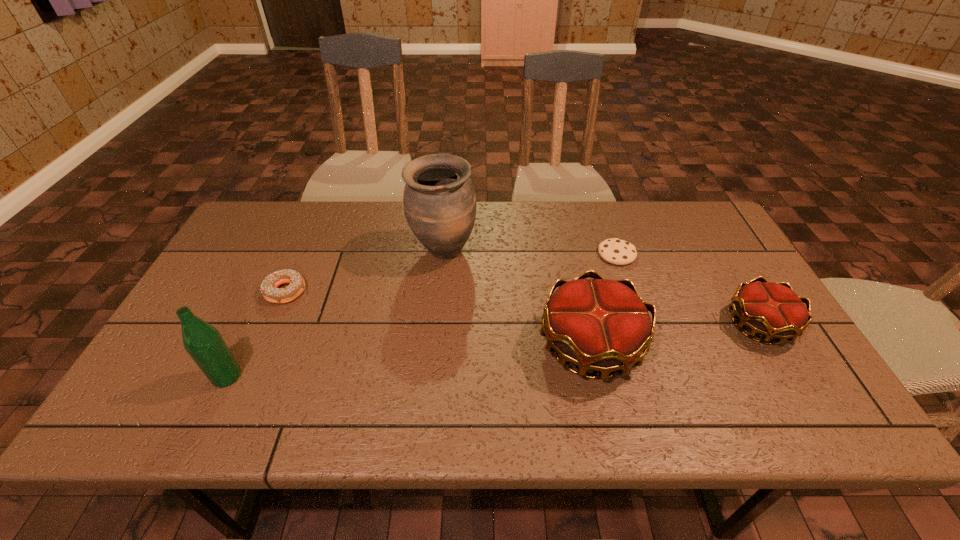
Identify the location of the taller crown. (602, 325).

You are a GUI agent. You are given a task and a screenshot of the screen. Output one action in this format:
    pyautogui.click(x=<x>, y=<y>)
    Task: Click on the left crown
    The image size is (960, 540).
    Given the screenshot: What is the action you would take?
    pyautogui.click(x=602, y=325)

Identify the location of the shorter crown. The width and height of the screenshot is (960, 540). (773, 310).

I want to click on the third shortest object, so click(773, 310).

In order to click on doughnut in this screenshot , I will do `click(269, 289)`.

The height and width of the screenshot is (540, 960). Identify the location of cookie. (616, 251).

I want to click on urn, so click(x=439, y=200).

The width and height of the screenshot is (960, 540). Identify the location of the tallest object. (439, 200).

Identify the location of bottle. This screenshot has width=960, height=540. (203, 342).

Find the location of a particular element. Image resolution: width=960 pixels, height=540 pixels. vacant region located on the right of the taller crown is located at coordinates (746, 345).